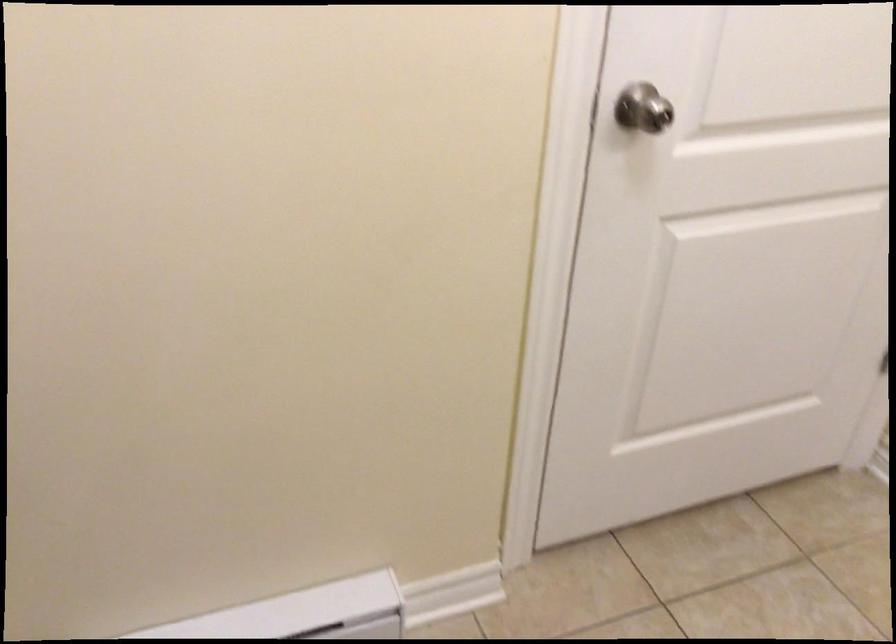
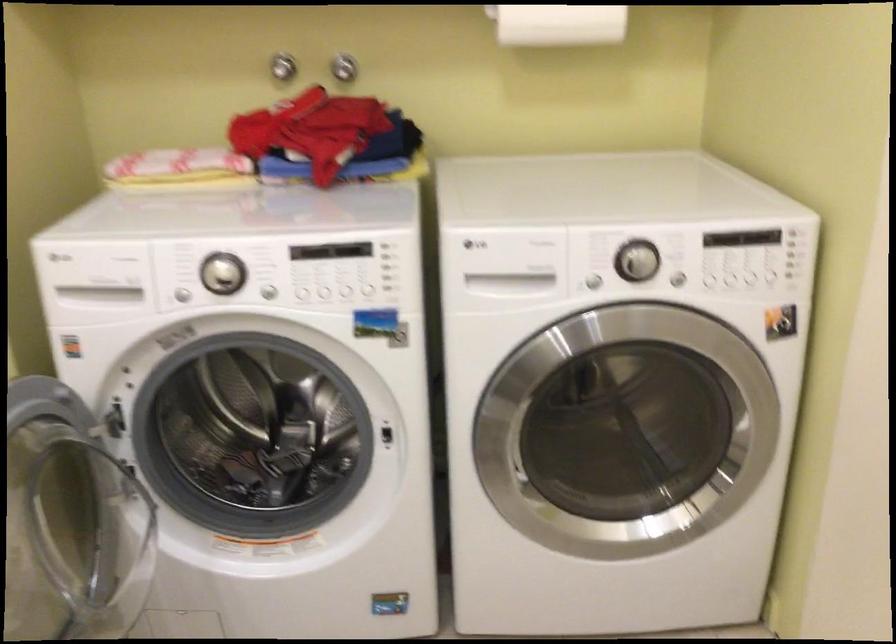
The images are taken continuously from a first-person perspective. In which direction is your viewpoint rotating?

The camera rotated toward left-down.